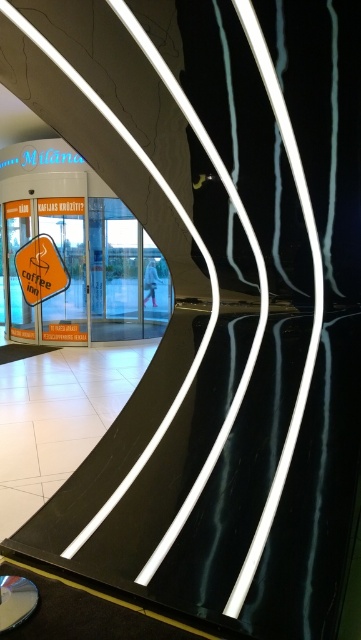
You are standing in the entrance area of the building and see two orange signs. The orange plastic sign at center and the orange matte coffee sign at left. Which one is more to the left?

The orange matte coffee sign at left is more to the left because the orange plastic sign at center is positioned on the right side of it.

You are standing at the entrance of the building and see the point marked at coordinates (57,259). What object is located at that point?

The point at coordinates (57,259) corresponds to the orange plastic sign at center.

You are designing a layout for a new coffee shop and want to place two orange signs in the entrance area. The orange plastic sign at center needs to be wider than the orange matte coffee sign at left. Which sign should you place in the center to meet this requirement?

The orange plastic sign at center has a larger width than the orange matte coffee sign at left, so placing the orange plastic sign at center in the center will meet the requirement.